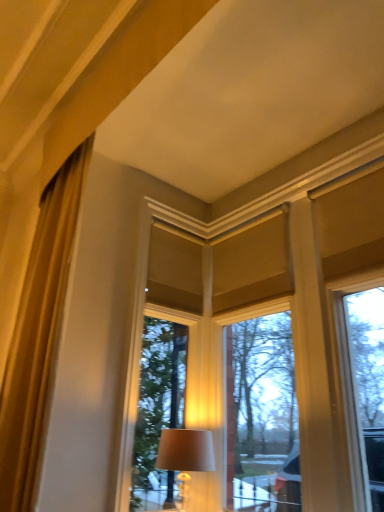
Question: Looking at their shapes, would you say matte cream window at center is wider or thinner than matte beige lampshade at center?

Choices:
 (A) wide
 (B) thin

Answer: (B)

Question: From a real-world perspective, is matte cream window at center physically located above or below matte beige lampshade at center?

Choices:
 (A) above
 (B) below

Answer: (A)

Question: Estimate the real-world distances between objects in this image. Which object is closer to the matte beige lampshade at center?

Choices:
 (A) matte cream window at center
 (B) gold silky curtain at left

Answer: (A)

Question: Which is nearer to the gold silky curtain at left?

Choices:
 (A) matte beige lampshade at center
 (B) matte cream window at center

Answer: (A)